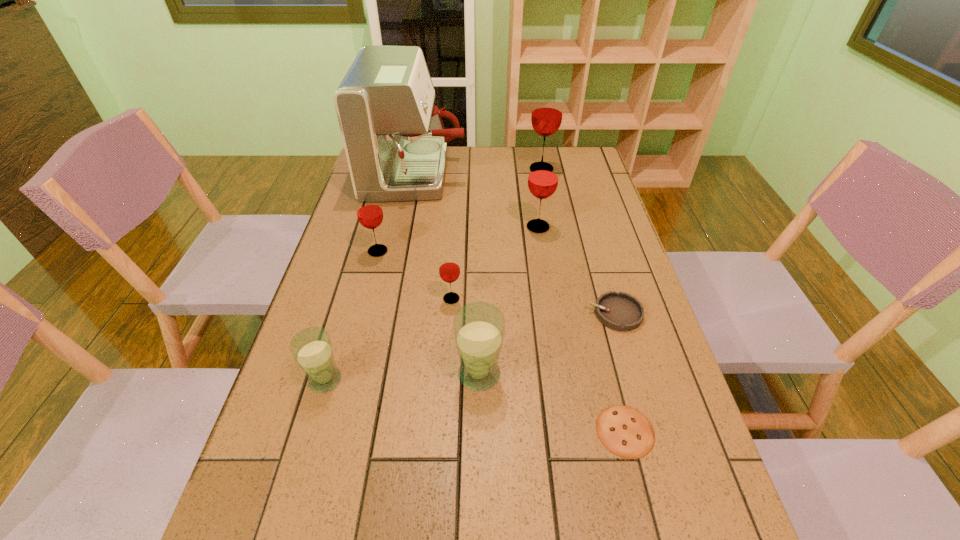
Find the location of a particular element. The width and height of the screenshot is (960, 540). blank area in the image that satisfies the following two spatial constraints: 1. on the front of the coffee maker near the spout; 2. on the left side of the gray ashtray is located at coordinates (389, 313).